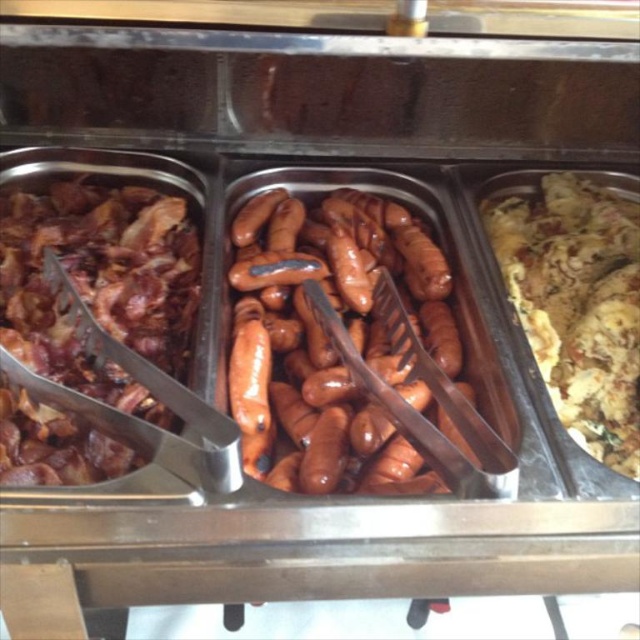
Question: Which point is farther from the camera taking this photo?

Choices:
 (A) (100, 285)
 (B) (378, 458)

Answer: (A)

Question: Which object is closer to the camera taking this photo?

Choices:
 (A) yellow crumbly at right
 (B) glossy brown sausages at center

Answer: (B)

Question: Which of the following is the closest to the observer?

Choices:
 (A) (636, 404)
 (B) (266, 259)

Answer: (A)

Question: Can you confirm if shiny brown bacon at left is bigger than yellow crumbly at right?

Choices:
 (A) no
 (B) yes

Answer: (B)

Question: Can you confirm if shiny brown bacon at left is positioned above yellow crumbly at right?

Choices:
 (A) no
 (B) yes

Answer: (A)

Question: Is shiny brown bacon at left positioned in front of yellow crumbly at right?

Choices:
 (A) yes
 (B) no

Answer: (A)